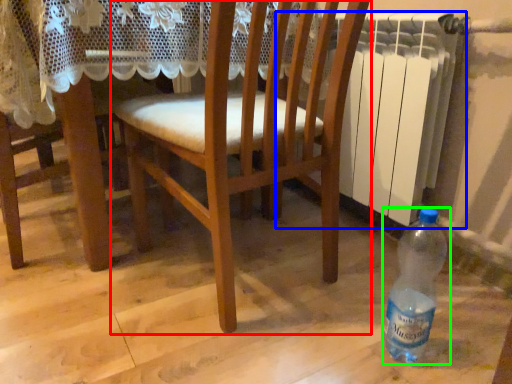
Question: Considering the real-world distances, which object is farthest from chair (highlighted by a red box)? radiator (highlighted by a blue box) or bottle (highlighted by a green box)?

Choices:
 (A) radiator
 (B) bottle

Answer: (B)